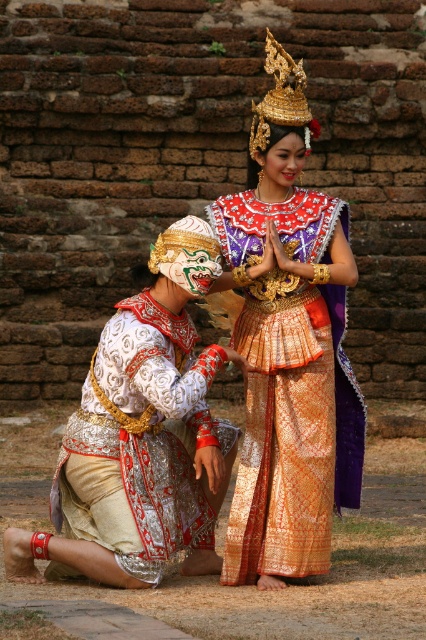
Question: Does gold brocade dress at center appear on the left side of white embroidered fabric at lower left?

Choices:
 (A) yes
 (B) no

Answer: (B)

Question: Which of the following is the closest to the observer?

Choices:
 (A) gold brocade dress at center
 (B) white embroidered fabric at lower left

Answer: (B)

Question: Among these objects, which one is nearest to the camera?

Choices:
 (A) white embroidered fabric at lower left
 (B) gold brocade dress at center

Answer: (A)

Question: Is gold brocade dress at center positioned before white embroidered fabric at lower left?

Choices:
 (A) no
 (B) yes

Answer: (A)

Question: Which object is closer to the camera taking this photo?

Choices:
 (A) gold brocade dress at center
 (B) white embroidered fabric at lower left

Answer: (B)

Question: Considering the relative positions of gold brocade dress at center and white embroidered fabric at lower left in the image provided, where is gold brocade dress at center located with respect to white embroidered fabric at lower left?

Choices:
 (A) below
 (B) above

Answer: (B)